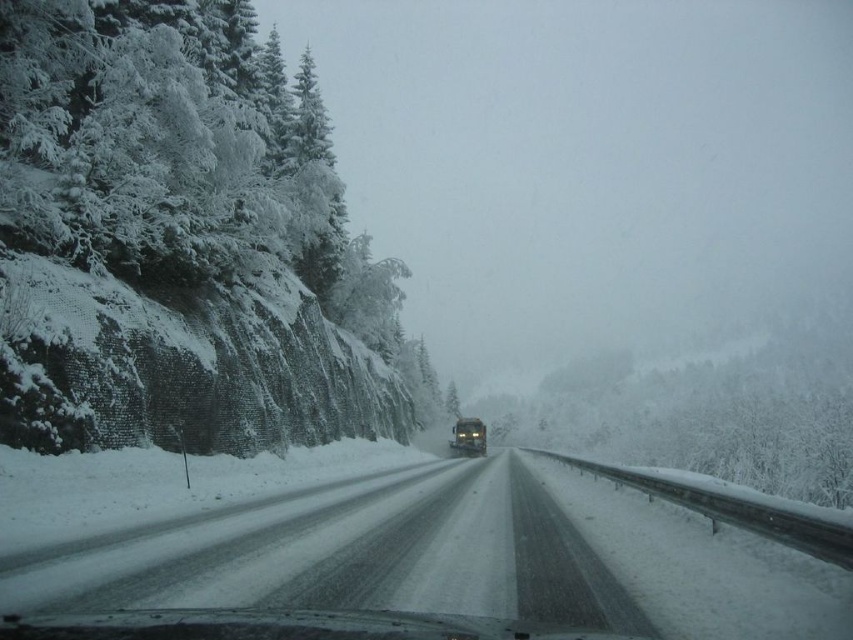
You are a driver in a car parked on the snowy asphalt road at center. You want to know if the white frosty trees at left are closer to you than the road. Can you determine this based on their sizes?

The white frosty trees at left are bigger than the snowy asphalt road at center, which suggests that they are closer to the observer since closer objects appear larger.

You are a passenger in the matte black bus at center. Looking out the window, you see the snowy asphalt road at center. Which side of the road is the bus currently on?

The snowy asphalt road at center is to the left of the matte black bus at center, so the bus is on the right side of the road.